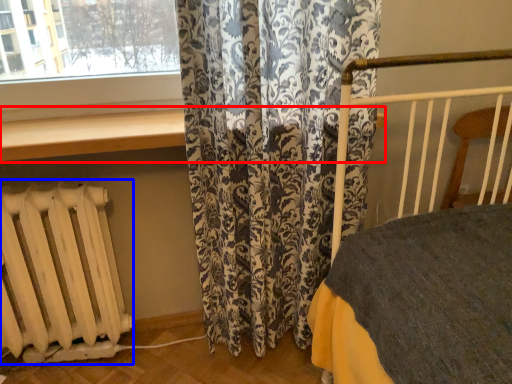
Question: Which object is closer to the camera taking this photo, window sill (highlighted by a red box) or radiator (highlighted by a blue box)?

Choices:
 (A) window sill
 (B) radiator

Answer: (A)